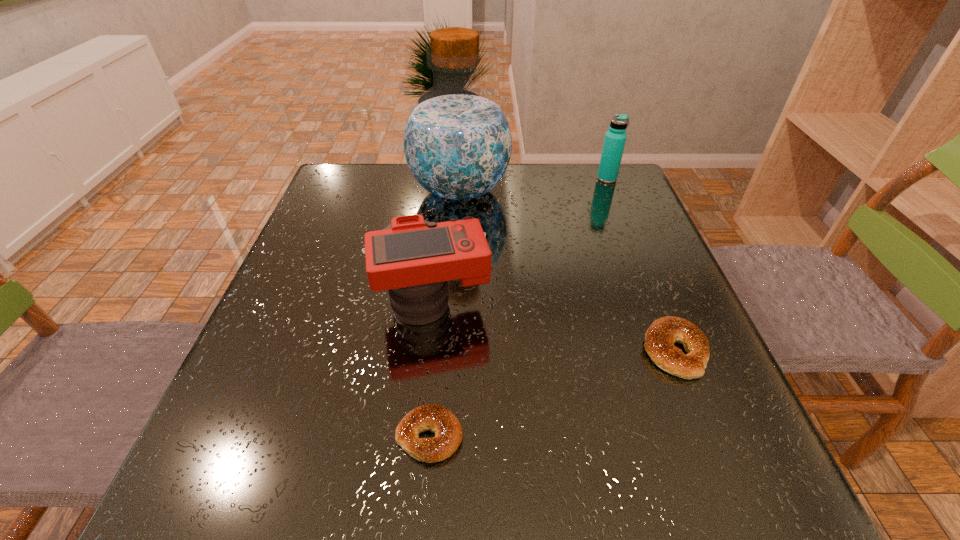
Where is `free space located on the front of the right bagel`? The image size is (960, 540). free space located on the front of the right bagel is located at coordinates (697, 407).

You are a GUI agent. You are given a task and a screenshot of the screen. Output one action in this format:
    pyautogui.click(x=<x>, y=<y>)
    Task: Click on the free point located on the right of the shorter bagel
    Image resolution: width=960 pixels, height=540 pixels.
    Given the screenshot: What is the action you would take?
    pyautogui.click(x=507, y=436)

Identify the location of water jug present at the far edge. (457, 141).

Where is `water bottle that is at the far edge`? The height and width of the screenshot is (540, 960). water bottle that is at the far edge is located at coordinates (615, 138).

You are a GUI agent. You are given a task and a screenshot of the screen. Output one action in this format:
    pyautogui.click(x=<x>, y=<y>)
    Task: Click on the object present at the near edge
    The height and width of the screenshot is (540, 960).
    Given the screenshot: What is the action you would take?
    pyautogui.click(x=448, y=432)

Image resolution: width=960 pixels, height=540 pixels. In order to click on water bottle that is at the right edge in this screenshot , I will do `click(615, 138)`.

Where is `bagel present at the right edge`? bagel present at the right edge is located at coordinates (660, 337).

Locate an element on the screen. object at the far right corner is located at coordinates (615, 138).

Locate an element on the screen. This screenshot has width=960, height=540. vacant area at the far edge is located at coordinates (497, 206).

Find the location of a particular element. This screenshot has width=960, height=540. free space at the left edge is located at coordinates (279, 355).